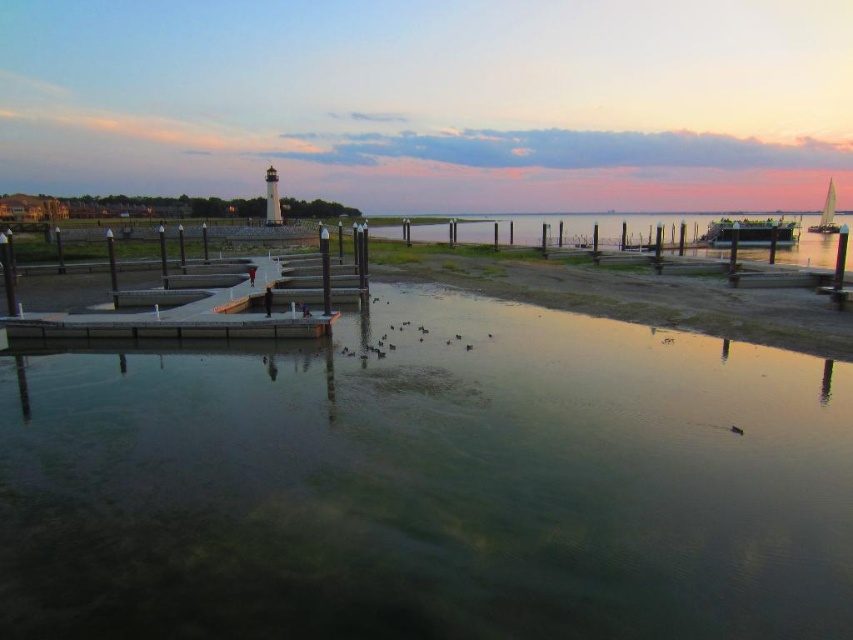
Between clear water at center and smooth concrete dock at center, which one is positioned higher?

smooth concrete dock at center

Between clear water at center and smooth concrete dock at center, which one appears on the left side from the viewer's perspective?

Positioned to the left is smooth concrete dock at center.

Is point (212, 378) behind point (306, 316)?

No, (212, 378) is closer to viewer.

This screenshot has height=640, width=853. Identify the location of clear water at center. (430, 484).

Between clear water at center and white sailboat at right, which one is positioned higher?

white sailboat at right is higher up.

Between point (506, 632) and point (830, 216), which one is positioned in front?

Point (506, 632) is in front.

Does point (471, 349) come behind point (828, 193)?

No.

Identify the location of clear water at center. Image resolution: width=853 pixels, height=640 pixels. (430, 484).

Does smooth concrete dock at center have a smaller size compared to white sailboat at right?

Yes, smooth concrete dock at center is smaller than white sailboat at right.

Between point (244, 259) and point (808, 228), which one is positioned in front?

Point (244, 259) is in front.

I want to click on smooth concrete dock at center, so click(212, 298).